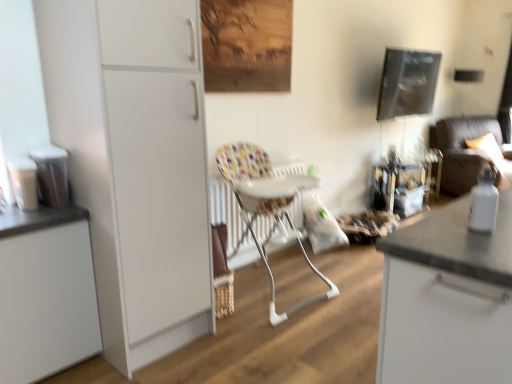
At what (x,y) coordinates should I click in order to perform the action: click on vacant region to the right of white matte cabinet at left, the 1th cabinetry when ordered from right to left. Please return your answer as a coordinate pair (x, y). Looking at the image, I should click on (240, 348).